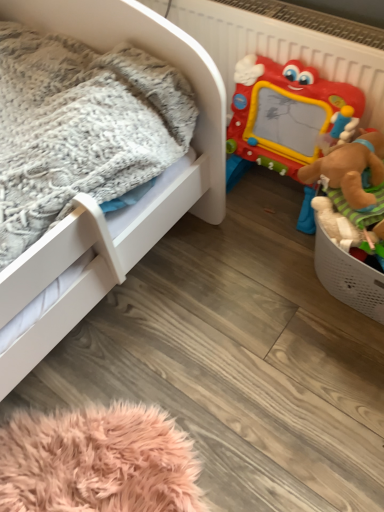
The image size is (384, 512). What do you see at coordinates (285, 112) in the screenshot?
I see `plastic drawing board at right` at bounding box center [285, 112].

I want to click on plastic drawing board at right, so click(285, 112).

Locate an element on the screen. The image size is (384, 512). white matte infant bed at left is located at coordinates (94, 201).

This screenshot has width=384, height=512. Describe the element at coordinates (94, 201) in the screenshot. I see `white matte infant bed at left` at that location.

At what (x,y) coordinates should I click in order to perform the action: click on plastic drawing board at right. Please return your answer as a coordinate pair (x, y). The width and height of the screenshot is (384, 512). Looking at the image, I should click on (285, 112).

In the scene shown: Between white matte infant bed at left and plastic drawing board at right, which one appears on the right side from the viewer's perspective?

From the viewer's perspective, plastic drawing board at right appears more on the right side.

Considering their positions, is white matte infant bed at left located in front of or behind plastic drawing board at right?

Visually, white matte infant bed at left is located in front of plastic drawing board at right.

Between point (31, 280) and point (310, 211), which one is positioned behind?

Point (310, 211)

From the image's perspective, is white matte infant bed at left below plastic drawing board at right?

Indeed, from the image's perspective, white matte infant bed at left is shown beneath plastic drawing board at right.

From a real-world perspective, between white matte infant bed at left and plastic drawing board at right, who is vertically higher?

From a 3D spatial view, white matte infant bed at left is above.

Looking at this image, is white matte infant bed at left wider or thinner than plastic drawing board at right?

In the image, white matte infant bed at left appears to be wider than plastic drawing board at right.

Does white matte infant bed at left have a lesser height compared to plastic drawing board at right?

In fact, white matte infant bed at left may be taller than plastic drawing board at right.

Who is bigger, white matte infant bed at left or plastic drawing board at right?

white matte infant bed at left.

Is white matte infant bed at left located outside plastic drawing board at right?

Yes, white matte infant bed at left is located beyond the bounds of plastic drawing board at right.

In the scene shown: Is white matte infant bed at left positioned far away from plastic drawing board at right?

white matte infant bed at left is near plastic drawing board at right, not far away.

Is white matte infant bed at left facing towards plastic drawing board at right?

No, white matte infant bed at left is not turned towards plastic drawing board at right.

At what (x,y) coordinates should I click in order to perform the action: click on toy that appears on the right of white matte infant bed at left. Please return your answer as a coordinate pair (x, y). Looking at the image, I should click on (285, 112).

Does plastic drawing board at right appear on the left side of white matte infant bed at left?

No.

Is plastic drawing board at right positioned behind white matte infant bed at left?

Yes, the depth of plastic drawing board at right is greater than that of white matte infant bed at left.

Considering the positions of points (316, 146) and (11, 266), is point (316, 146) closer to camera compared to point (11, 266)?

No, it is behind (11, 266).

From the image's perspective, who appears lower, plastic drawing board at right or white matte infant bed at left?

white matte infant bed at left is shown below in the image.

From a real-world perspective, which object stands above the other?

white matte infant bed at left.

In terms of width, does plastic drawing board at right look wider or thinner when compared to white matte infant bed at left?

In the image, plastic drawing board at right appears to be more narrow than white matte infant bed at left.

Between plastic drawing board at right and white matte infant bed at left, which one has less height?

plastic drawing board at right is shorter.

Is plastic drawing board at right smaller than white matte infant bed at left?

Yes, plastic drawing board at right is smaller than white matte infant bed at left.

Is white matte infant bed at left a part of plastic drawing board at right?

No, white matte infant bed at left is not surrounded by plastic drawing board at right.

Is plastic drawing board at right positioned far away from white matte infant bed at left?

No, there isn't a large distance between plastic drawing board at right and white matte infant bed at left.

Is plastic drawing board at right facing away from white matte infant bed at left?

No, plastic drawing board at right is not facing away from white matte infant bed at left.

Can you tell me how much plastic drawing board at right and white matte infant bed at left differ in facing direction?

The angle between the facing direction of plastic drawing board at right and the facing direction of white matte infant bed at left is 88.4 degrees.

This screenshot has height=512, width=384. Identify the location of toy that appears above the white matte infant bed at left (from the image's perspective). (285, 112).

Where is `infant bed on the left of plastic drawing board at right`? infant bed on the left of plastic drawing board at right is located at coordinates (94, 201).

You are a GUI agent. You are given a task and a screenshot of the screen. Output one action in this format:
    pyautogui.click(x=<x>, y=<y>)
    Task: Click on the infant bed above the plastic drawing board at right (from a real-world perspective)
    
    Given the screenshot: What is the action you would take?
    pyautogui.click(x=94, y=201)